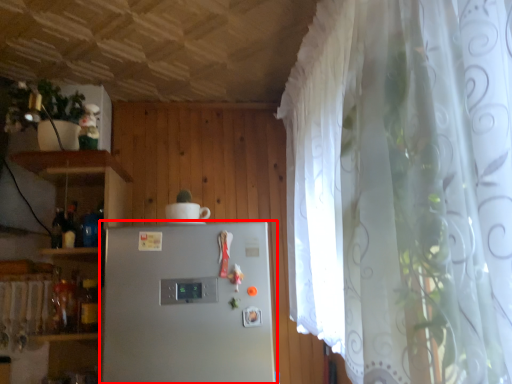
Question: Observing the image, what is the correct spatial positioning of refrigerator (annotated by the red box) in reference to appliance?

Choices:
 (A) right
 (B) left

Answer: (A)